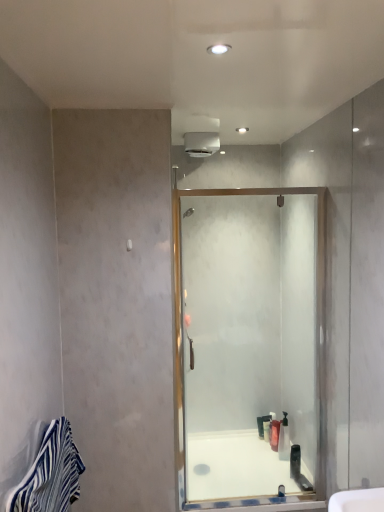
Image resolution: width=384 pixels, height=512 pixels. What are the coordinates of `clear glass shower door at center` in the screenshot? It's located at (248, 345).

You are a GUI agent. You are given a task and a screenshot of the screen. Output one action in this format:
    pyautogui.click(x=<x>, y=<y>)
    Task: Click on the translucent plastic bottle at lower center, which ranks as the 1th toiletry in back-to-front order
    The image size is (384, 512).
    Given the screenshot: What is the action you would take?
    pyautogui.click(x=262, y=424)

Describe the element at coordinates (43, 470) in the screenshot. I see `blue striped towel at lower left` at that location.

Where is `translucent plastic bottle at center, the second toiletry positioned from the back`? translucent plastic bottle at center, the second toiletry positioned from the back is located at coordinates (274, 434).

Measure the distance between point (270,431) and camera.

Point (270,431) and camera are 9.65 feet apart.

The image size is (384, 512). I want to click on translucent plastic soap dispenser at center, which is the first toiletry in front-to-back order, so click(284, 438).

Is translucent plastic soap dispenser at center, which is the first toiletry in front-to-back order, to the left of translucent plastic bottle at lower center, which ranks as the 1th toiletry in back-to-front order, from the viewer's perspective?

No, translucent plastic soap dispenser at center, which is the first toiletry in front-to-back order, is not to the left of translucent plastic bottle at lower center, which ranks as the 1th toiletry in back-to-front order.

From the image's perspective, which one is positioned lower, translucent plastic soap dispenser at center, which is the first toiletry in front-to-back order, or translucent plastic bottle at lower center, which ranks as the 3th toiletry in front-to-back order?

translucent plastic bottle at lower center, which ranks as the 3th toiletry in front-to-back order, from the image's perspective.

From a real-world perspective, which is physically below, translucent plastic soap dispenser at center, placed as the 3th toiletry when sorted from back to front, or translucent plastic bottle at lower center, which ranks as the 3th toiletry in front-to-back order?

From a 3D spatial view, translucent plastic bottle at lower center, which ranks as the 3th toiletry in front-to-back order, is below.

Which is in front, point (277, 437) or point (279, 455)?

The point (279, 455) is in front.

Is translucent plastic bottle at center, the second toiletry positioned from the back, not close to translucent plastic soap dispenser at center, placed as the 3th toiletry when sorted from back to front?

No, translucent plastic bottle at center, the second toiletry positioned from the back, is not far away from translucent plastic soap dispenser at center, placed as the 3th toiletry when sorted from back to front.

Is translucent plastic bottle at center, the second toiletry positioned from the back, aimed at translucent plastic soap dispenser at center, which is the first toiletry in front-to-back order?

No, translucent plastic bottle at center, the second toiletry positioned from the back, is not oriented towards translucent plastic soap dispenser at center, which is the first toiletry in front-to-back order.

From the picture: From the image's perspective, which is above, translucent plastic bottle at lower center, which ranks as the 1th toiletry in back-to-front order, or clear glass shower door at center?

From the image's view, clear glass shower door at center is above.

Would you consider translucent plastic bottle at lower center, which ranks as the 1th toiletry in back-to-front order, to be distant from clear glass shower door at center?

No, translucent plastic bottle at lower center, which ranks as the 1th toiletry in back-to-front order, is in close proximity to clear glass shower door at center.

Could you measure the distance between translucent plastic bottle at lower center, which ranks as the 3th toiletry in front-to-back order, and clear glass shower door at center?

translucent plastic bottle at lower center, which ranks as the 3th toiletry in front-to-back order, and clear glass shower door at center are 31.66 inches apart.

Does translucent plastic bottle at lower center, which ranks as the 3th toiletry in front-to-back order, have a smaller size compared to clear glass shower door at center?

Correct, translucent plastic bottle at lower center, which ranks as the 3th toiletry in front-to-back order, occupies less space than clear glass shower door at center.

Considering the sizes of objects blue striped towel at lower left and translucent plastic bottle at lower center, which ranks as the 3th toiletry in front-to-back order, in the image provided, who is thinner, blue striped towel at lower left or translucent plastic bottle at lower center, which ranks as the 3th toiletry in front-to-back order,?

With smaller width is translucent plastic bottle at lower center, which ranks as the 3th toiletry in front-to-back order.

Considering their positions, is blue striped towel at lower left located in front of or behind translucent plastic bottle at lower center, which ranks as the 1th toiletry in back-to-front order?

In the image, blue striped towel at lower left appears in front of translucent plastic bottle at lower center, which ranks as the 1th toiletry in back-to-front order.

Does point (42, 460) come farther from viewer compared to point (267, 416)?

No.

In the scene shown: Which object is more forward, translucent plastic bottle at center, marked as the second toiletry in a front-to-back arrangement, or clear glass shower door at center?

Positioned in front is clear glass shower door at center.

Does translucent plastic bottle at center, marked as the second toiletry in a front-to-back arrangement, have a greater height compared to clear glass shower door at center?

In fact, translucent plastic bottle at center, marked as the second toiletry in a front-to-back arrangement, may be shorter than clear glass shower door at center.

Does point (274, 436) come in front of point (285, 232)?

Yes, it is in front of point (285, 232).

Is translucent plastic bottle at center, the second toiletry positioned from the back, placed right next to clear glass shower door at center?

No, translucent plastic bottle at center, the second toiletry positioned from the back, is not beside clear glass shower door at center.

Identify the location of bath in front of the translucent plastic soap dispenser at center, placed as the 3th toiletry when sorted from back to front. (234, 466).

Would you say white glossy bath at center is inside or outside translucent plastic soap dispenser at center, which is the first toiletry in front-to-back order?

white glossy bath at center lies outside translucent plastic soap dispenser at center, which is the first toiletry in front-to-back order.

From a real-world perspective, is white glossy bath at center above or below translucent plastic soap dispenser at center, which is the first toiletry in front-to-back order?

white glossy bath at center is below translucent plastic soap dispenser at center, which is the first toiletry in front-to-back order.

Is white glossy bath at center directly adjacent to translucent plastic soap dispenser at center, which is the first toiletry in front-to-back order?

No.

Considering the relative sizes of blue striped towel at lower left and translucent plastic bottle at center, the second toiletry positioned from the back, in the image provided, is blue striped towel at lower left shorter than translucent plastic bottle at center, the second toiletry positioned from the back,?

Incorrect, the height of blue striped towel at lower left does not fall short of that of translucent plastic bottle at center, the second toiletry positioned from the back.

Is blue striped towel at lower left completely or partially outside of translucent plastic bottle at center, the second toiletry positioned from the back?

Yes, blue striped towel at lower left is not within translucent plastic bottle at center, the second toiletry positioned from the back.

Which object is positioned more to the left, blue striped towel at lower left or translucent plastic bottle at center, the second toiletry positioned from the back?

blue striped towel at lower left is more to the left.

This screenshot has width=384, height=512. I want to click on toiletry that is the 2nd object to the left of the translucent plastic soap dispenser at center, placed as the 3th toiletry when sorted from back to front, starting at the anchor, so click(262, 424).

I want to click on toiletry that appears above the translucent plastic bottle at center, marked as the second toiletry in a front-to-back arrangement (from a real-world perspective), so click(x=284, y=438).

Which object lies nearer to the anchor point blue striped towel at lower left, translucent plastic bottle at lower center, which ranks as the 1th toiletry in back-to-front order, or clear glass shower door at center?

clear glass shower door at center.

From the image, which object appears to be nearer to white glossy bath at center, translucent plastic bottle at center, marked as the second toiletry in a front-to-back arrangement, or translucent plastic soap dispenser at center, placed as the 3th toiletry when sorted from back to front?

Among the two, translucent plastic bottle at center, marked as the second toiletry in a front-to-back arrangement, is located nearer to white glossy bath at center.

Looking at the image, which one is located further to translucent plastic bottle at lower center, which ranks as the 1th toiletry in back-to-front order, white glossy bath at center or blue striped towel at lower left?

Based on the image, blue striped towel at lower left appears to be further to translucent plastic bottle at lower center, which ranks as the 1th toiletry in back-to-front order.

Based on their spatial positions, is translucent plastic soap dispenser at center, placed as the 3th toiletry when sorted from back to front, or translucent plastic bottle at lower center, which ranks as the 3th toiletry in front-to-back order, further from white glossy bath at center?

translucent plastic soap dispenser at center, placed as the 3th toiletry when sorted from back to front, lies further to white glossy bath at center than the other object.

From the image, which object appears to be farther from clear glass shower door at center, translucent plastic soap dispenser at center, which is the first toiletry in front-to-back order, or white glossy bath at center?

translucent plastic soap dispenser at center, which is the first toiletry in front-to-back order.

Which object lies further to the anchor point blue striped towel at lower left, clear glass shower door at center or translucent plastic bottle at lower center, which ranks as the 1th toiletry in back-to-front order?

translucent plastic bottle at lower center, which ranks as the 1th toiletry in back-to-front order, is positioned further to the anchor blue striped towel at lower left.

Considering their positions, is clear glass shower door at center positioned further to translucent plastic bottle at center, marked as the second toiletry in a front-to-back arrangement, than translucent plastic soap dispenser at center, which is the first toiletry in front-to-back order?

clear glass shower door at center is further to translucent plastic bottle at center, marked as the second toiletry in a front-to-back arrangement.

Based on their spatial positions, is translucent plastic soap dispenser at center, which is the first toiletry in front-to-back order, or clear glass shower door at center further from blue striped towel at lower left?

translucent plastic soap dispenser at center, which is the first toiletry in front-to-back order.

At what (x,y) coordinates should I click in order to perform the action: click on toiletry between blue striped towel at lower left and translucent plastic bottle at center, the second toiletry positioned from the back, along the z-axis. Please return your answer as a coordinate pair (x, y). Image resolution: width=384 pixels, height=512 pixels. Looking at the image, I should click on (284, 438).

The image size is (384, 512). I want to click on screen door between blue striped towel at lower left and translucent plastic bottle at lower center, which ranks as the 3th toiletry in front-to-back order, along the z-axis, so click(x=248, y=345).

Locate an element on the screen. The height and width of the screenshot is (512, 384). bath positioned between blue striped towel at lower left and translucent plastic bottle at center, the second toiletry positioned from the back, from near to far is located at coordinates (234, 466).

Locate an element on the screen. The width and height of the screenshot is (384, 512). toiletry between clear glass shower door at center and translucent plastic bottle at center, the second toiletry positioned from the back, from front to back is located at coordinates (284, 438).